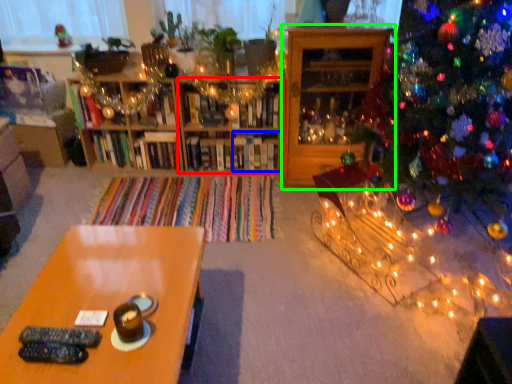
Question: Which object is positioned closest to shelf (highlighted by a red box)? Select from shelf (highlighted by a blue box) and shelf (highlighted by a green box).

Choices:
 (A) shelf
 (B) shelf

Answer: (A)